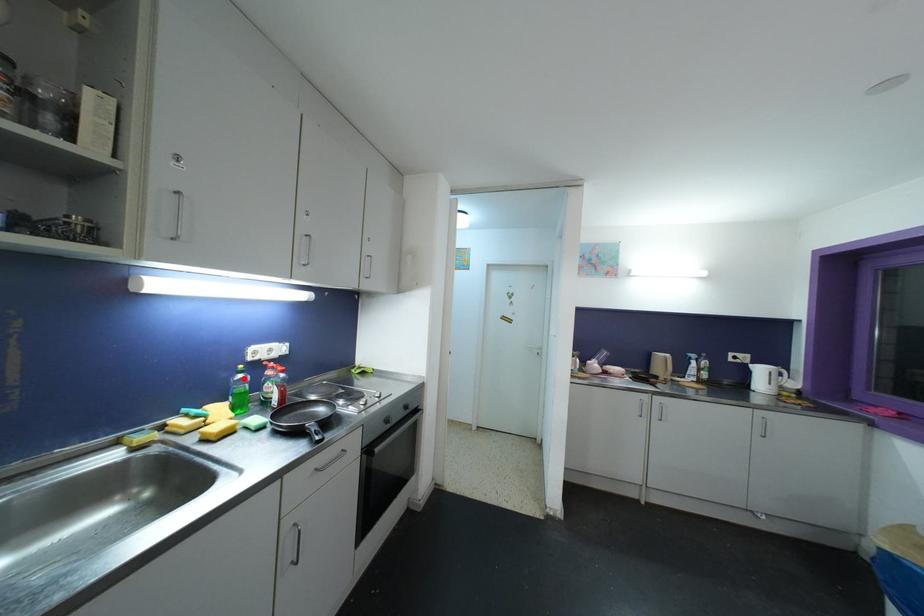
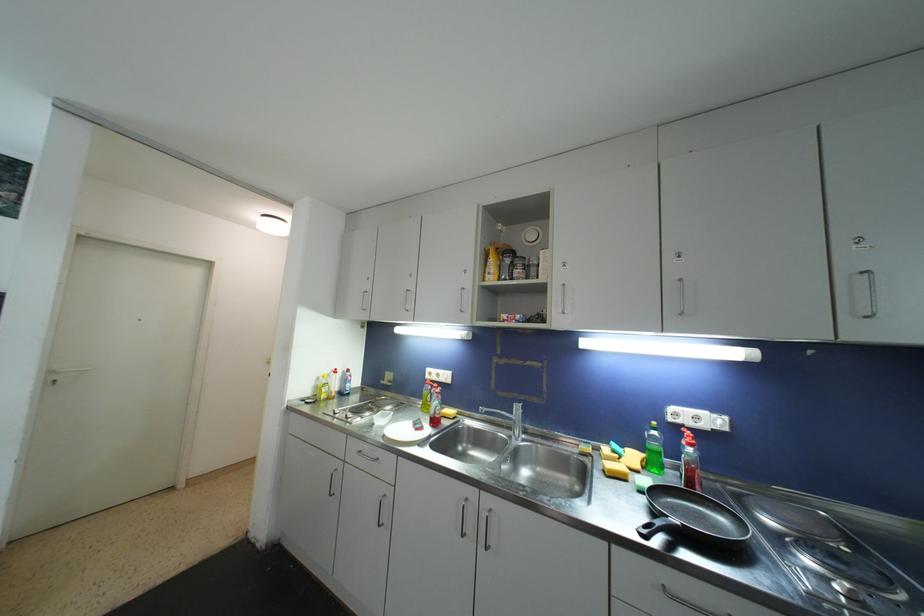
Question: I am providing you with two images of the same scene from different viewpoints. A red point is marked on the first image. Is the red point's position out of view in image 2?

Choices:
 (A) Yes
 (B) No

Answer: (B)